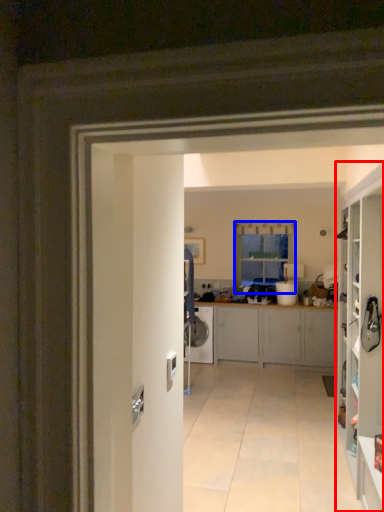
Question: Which point is further to the camera, cabinetry (highlighted by a red box) or window (highlighted by a blue box)?

Choices:
 (A) cabinetry
 (B) window

Answer: (B)